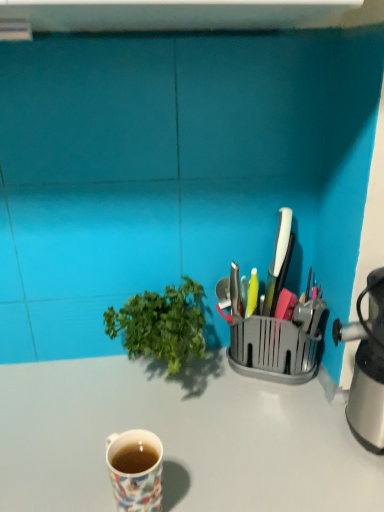
Question: From the image's perspective, would you say floral ceramic mug at lower left is positioned over white glossy desk at center?

Choices:
 (A) yes
 (B) no

Answer: (A)

Question: Is floral ceramic mug at lower left to the right of white glossy desk at center from the viewer's perspective?

Choices:
 (A) no
 (B) yes

Answer: (A)

Question: Would you say floral ceramic mug at lower left is a long distance from white glossy desk at center?

Choices:
 (A) no
 (B) yes

Answer: (A)

Question: Is the depth of floral ceramic mug at lower left less than that of white glossy desk at center?

Choices:
 (A) no
 (B) yes

Answer: (B)

Question: From a real-world perspective, is floral ceramic mug at lower left located higher than white glossy desk at center?

Choices:
 (A) no
 (B) yes

Answer: (B)

Question: In the image, is metallic silver knife block at right on the left side or the right side of floral ceramic mug at lower left?

Choices:
 (A) left
 (B) right

Answer: (B)

Question: From a real-world perspective, is metallic silver knife block at right physically located above or below floral ceramic mug at lower left?

Choices:
 (A) below
 (B) above

Answer: (B)

Question: Considering the positions of metallic silver knife block at right and floral ceramic mug at lower left in the image, is metallic silver knife block at right bigger or smaller than floral ceramic mug at lower left?

Choices:
 (A) big
 (B) small

Answer: (A)

Question: From the image's perspective, is metallic silver knife block at right located above or below floral ceramic mug at lower left?

Choices:
 (A) above
 (B) below

Answer: (A)

Question: Does point (97, 493) appear closer or farther from the camera than point (274, 304)?

Choices:
 (A) farther
 (B) closer

Answer: (B)

Question: Is white glossy desk at center situated inside metallic silver knife block at right or outside?

Choices:
 (A) outside
 (B) inside

Answer: (A)

Question: In terms of size, does white glossy desk at center appear bigger or smaller than metallic silver knife block at right?

Choices:
 (A) small
 (B) big

Answer: (B)

Question: From the image's perspective, is white glossy desk at center above or below metallic silver knife block at right?

Choices:
 (A) above
 (B) below

Answer: (B)

Question: Would you say floral ceramic mug at lower left is inside or outside white glossy desk at center?

Choices:
 (A) outside
 (B) inside

Answer: (A)

Question: Based on their sizes in the image, would you say floral ceramic mug at lower left is bigger or smaller than white glossy desk at center?

Choices:
 (A) small
 (B) big

Answer: (A)